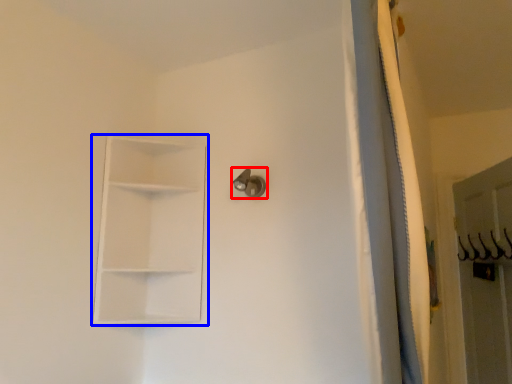
Question: Which object appears closest to the camera in this image, door handle (highlighted by a red box) or shelf (highlighted by a blue box)?

Choices:
 (A) door handle
 (B) shelf

Answer: (B)